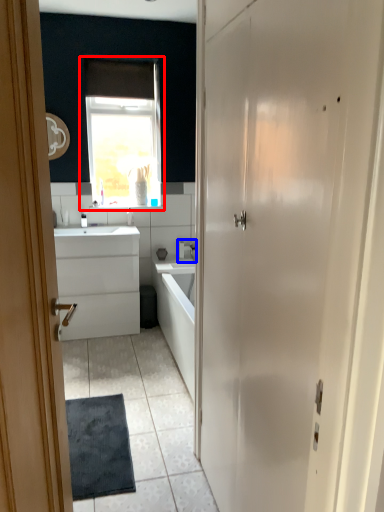
Question: Among these objects, which one is farthest to the camera, window (highlighted by a red box) or tap (highlighted by a blue box)?

Choices:
 (A) window
 (B) tap

Answer: (B)